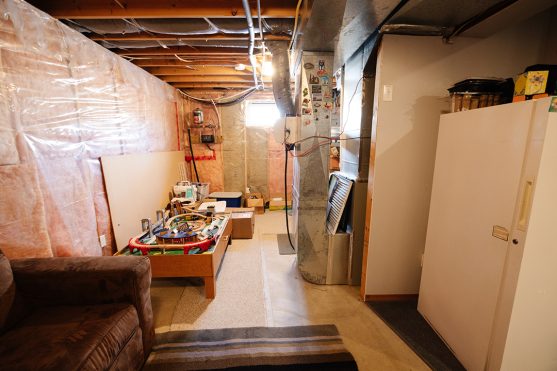
At what (x,y) coordinates should I click in order to perform the action: click on cushion. Please return your answer as a coordinate pair (x, y). The height and width of the screenshot is (371, 557). Looking at the image, I should click on (115, 341).